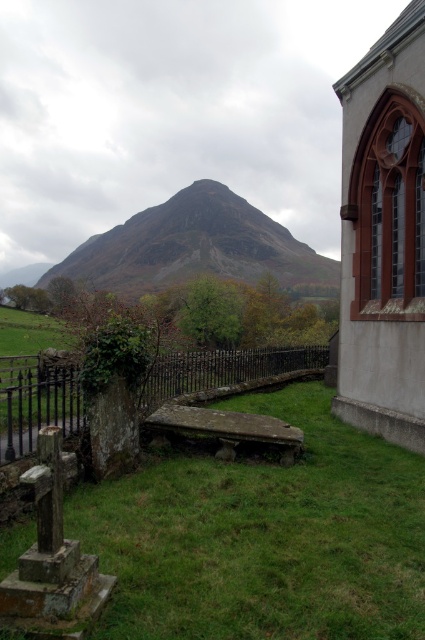
Question: Can you confirm if rustic brown mountain at center is wider than rusty metal fence at center?

Choices:
 (A) yes
 (B) no

Answer: (A)

Question: Considering the real-world distances, which object is farthest from the smooth stone church at right?

Choices:
 (A) rusty metal fence at center
 (B) rustic brown mountain at center
 (C) green grassy at lower center

Answer: (B)

Question: Can you confirm if smooth stone church at right is thinner than rustic brown mountain at center?

Choices:
 (A) yes
 (B) no

Answer: (A)

Question: Does smooth stone church at right have a smaller size compared to rusty metal fence at center?

Choices:
 (A) no
 (B) yes

Answer: (B)

Question: Among these points, which one is farthest from the camera?

Choices:
 (A) (22, 406)
 (B) (362, 481)
 (C) (407, 161)

Answer: (C)

Question: Which of the following is the farthest from the observer?

Choices:
 (A) rusty metal fence at center
 (B) rustic brown mountain at center
 (C) smooth stone church at right
 (D) green grassy at lower center

Answer: (B)